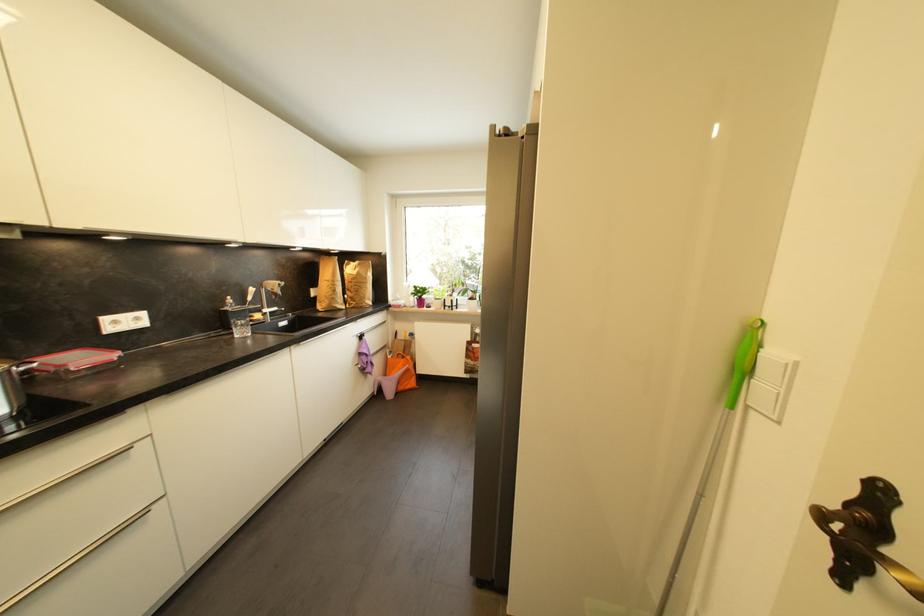
Describe the element at coordinates (857, 530) in the screenshot. I see `the brass door handle` at that location.